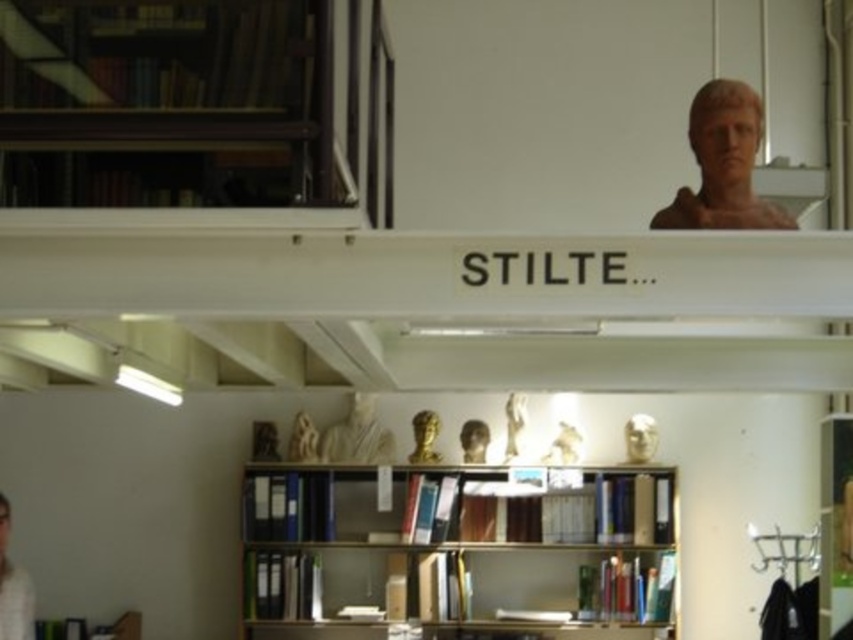
Question: Which object is the closest to the white matte person at lower left?

Choices:
 (A) white marble statue at center
 (B) matte brown bust at upper right

Answer: (A)

Question: Is the position of white matte person at lower left less distant than that of white marble bust at upper center?

Choices:
 (A) no
 (B) yes

Answer: (B)

Question: Among these points, which one is farthest from the camera?

Choices:
 (A) (474, 458)
 (B) (743, 177)
 (C) (422, 422)
 (D) (334, 440)

Answer: (D)

Question: Does wooden bookshelf at center lie in front of matte white bust at center?

Choices:
 (A) no
 (B) yes

Answer: (B)

Question: Is white matte person at lower left above white marble bust at upper center?

Choices:
 (A) no
 (B) yes

Answer: (A)

Question: Which point is farther to the camera?

Choices:
 (A) white marble statue at center
 (B) matte white bust at center

Answer: (B)